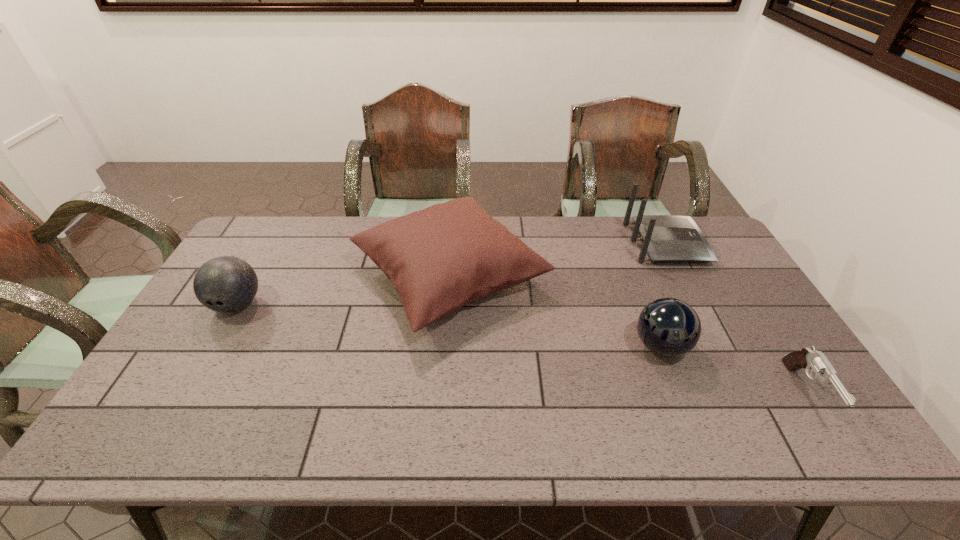
Where is `free space located on the side of the nearer bowling ball with the finger holes`? Image resolution: width=960 pixels, height=540 pixels. free space located on the side of the nearer bowling ball with the finger holes is located at coordinates (558, 346).

At what (x,y) coordinates should I click in order to perform the action: click on free space located 0.270m on the side of the nearer bowling ball with the finger holes. Please return your answer as a coordinate pair (x, y). Looking at the image, I should click on (532, 346).

Where is `cushion that is at the far edge`? This screenshot has width=960, height=540. cushion that is at the far edge is located at coordinates (441, 258).

Find the location of a particular element. router that is at the far edge is located at coordinates (666, 238).

At what (x,y) coordinates should I click in order to perform the action: click on object that is at the near edge. Please return your answer as a coordinate pair (x, y). Looking at the image, I should click on pyautogui.click(x=807, y=358).

This screenshot has height=540, width=960. What are the coordinates of `object that is at the left edge` in the screenshot? It's located at pos(224,284).

At what (x,y) coordinates should I click in order to perform the action: click on router that is at the right edge. Please return your answer as a coordinate pair (x, y). Looking at the image, I should click on (666, 238).

Identify the location of gun positioned at the right edge. (807, 358).

At what (x,y) coordinates should I click in order to perform the action: click on object at the far right corner. Please return your answer as a coordinate pair (x, y). Looking at the image, I should click on (666, 238).

What are the coordinates of `object at the near right corner` in the screenshot? It's located at (807, 358).